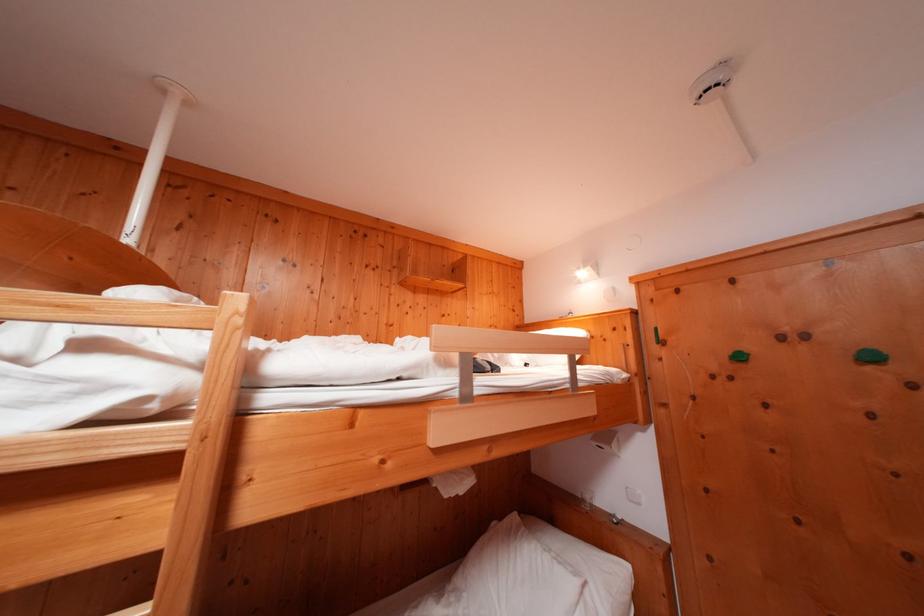
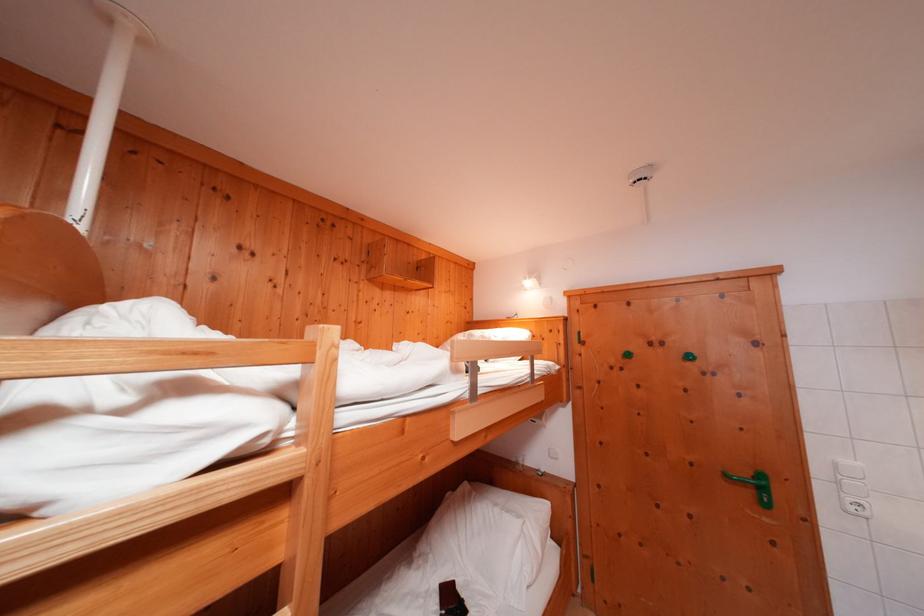
Where in the second image is the point corresponding to [465,398] from the first image?

(476, 399)